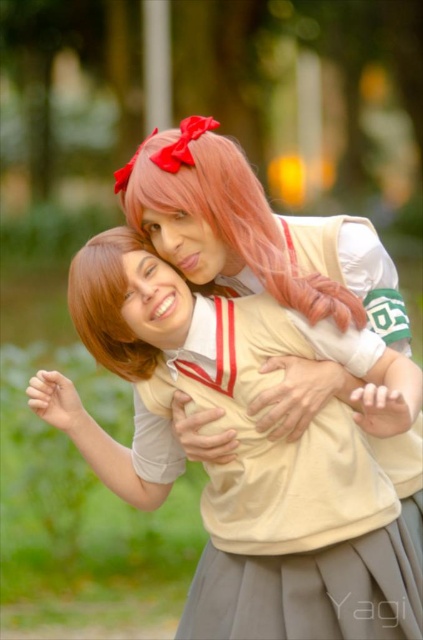
What do you see at coordinates (249, 451) in the screenshot? I see `matte beige uniform at center` at bounding box center [249, 451].

Does matte beige uniform at center appear on the right side of pink silky wig at upper center?

In fact, matte beige uniform at center is to the left of pink silky wig at upper center.

Locate an element on the screen. This screenshot has width=423, height=640. matte beige uniform at center is located at coordinates (249, 451).